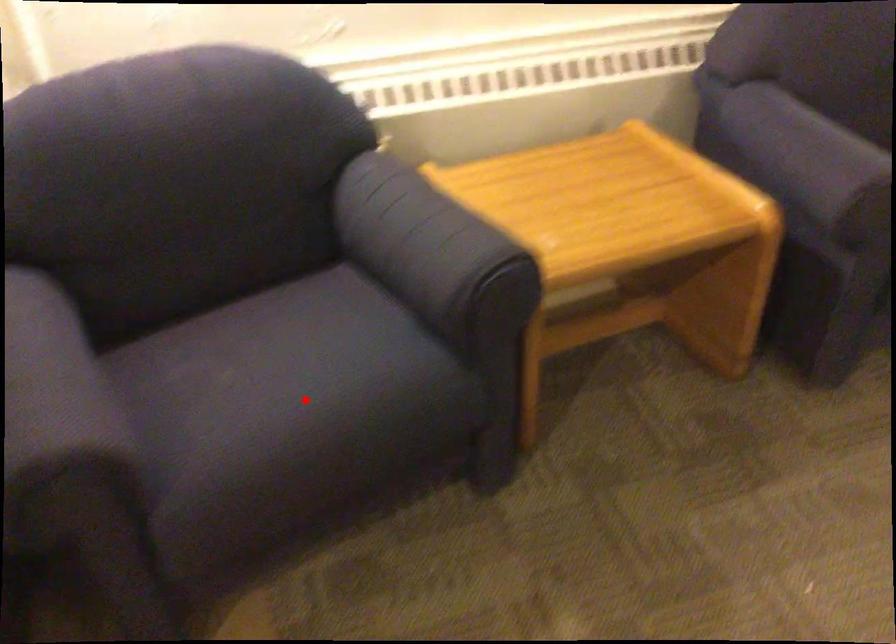
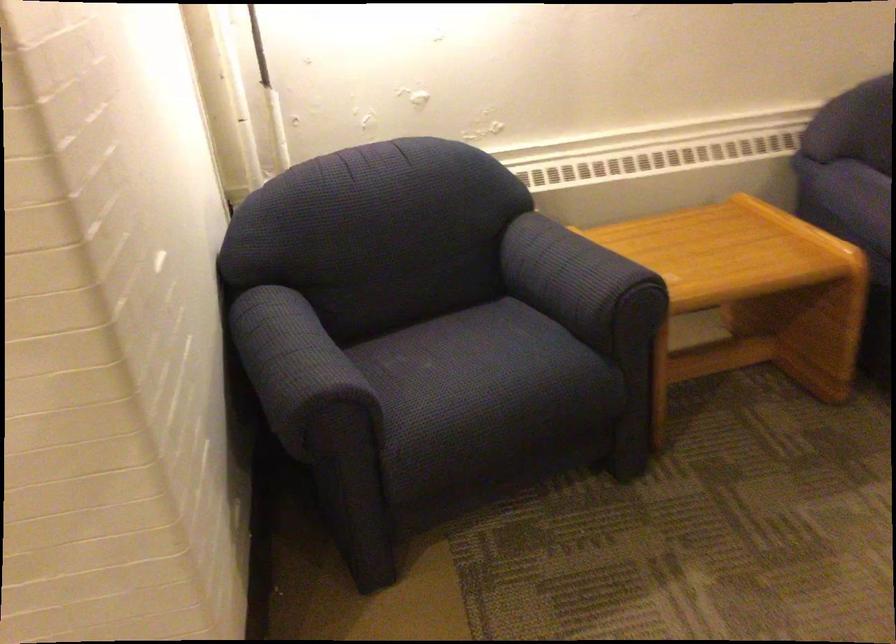
Question: I am providing you with two images of the same scene from different viewpoints. Given a red point in image1, look at the same physical point in image2. Is it:

Choices:
 (A) Closer to the viewpoint
 (B) Farther from the viewpoint

Answer: (B)